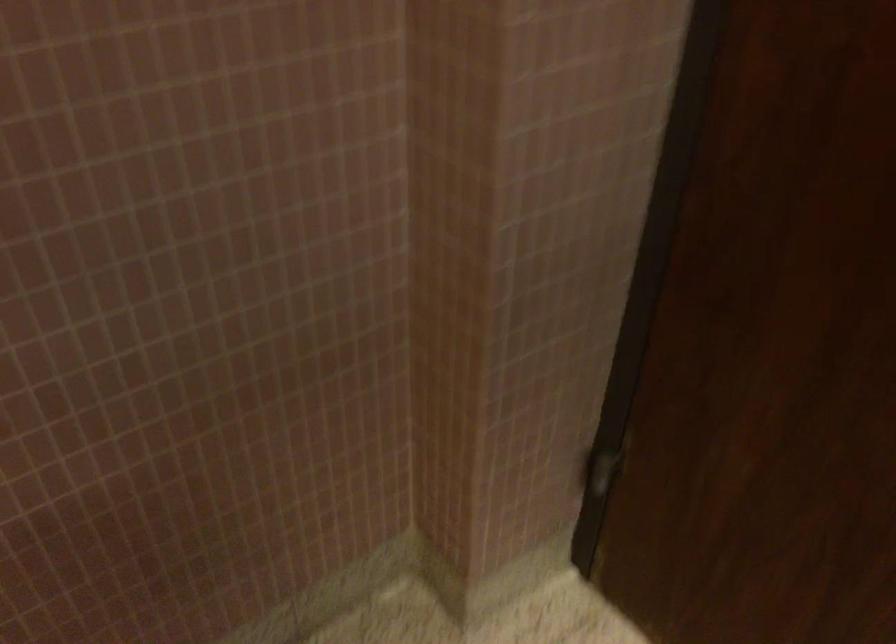
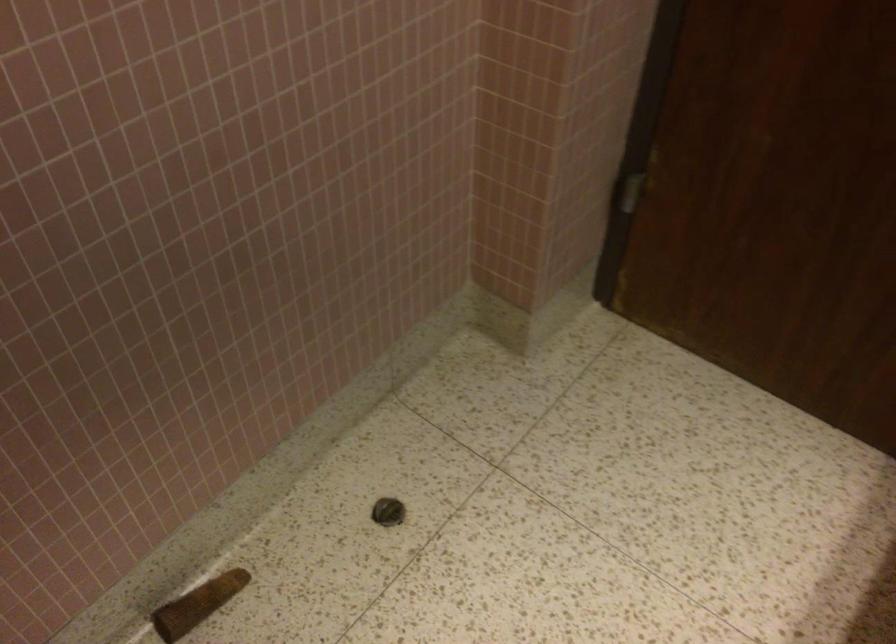
Question: The first image is from the beginning of the video and the second image is from the end. How did the camera likely rotate when shooting the video?

Choices:
 (A) Left
 (B) Right
 (C) Up
 (D) Down

Answer: (B)